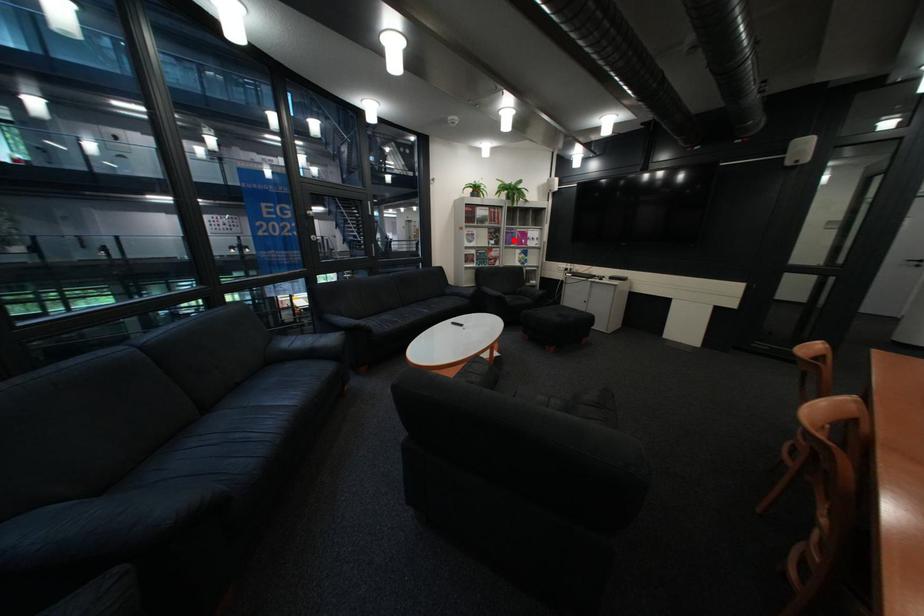
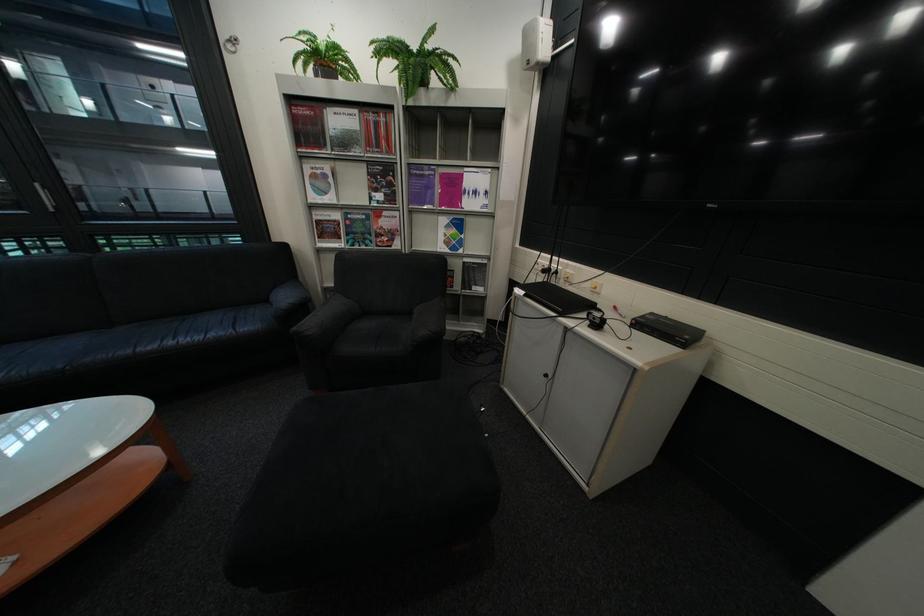
Locate, in the second image, the point that corresponds to the highlighted location in the first image.

(409, 192)